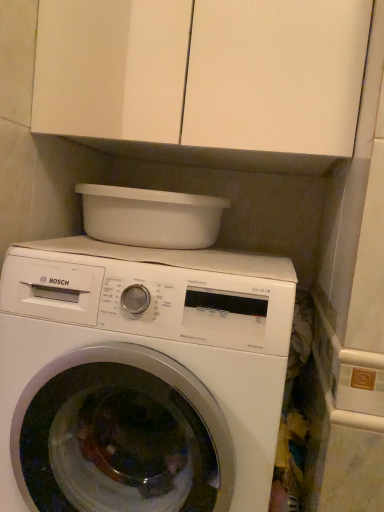
Question: Is white glossy washing machine at center beside white plastic basin at upper center?

Choices:
 (A) no
 (B) yes

Answer: (A)

Question: Can you confirm if white glossy washing machine at center is smaller than white plastic basin at upper center?

Choices:
 (A) yes
 (B) no

Answer: (B)

Question: Is white glossy washing machine at center in front of white plastic basin at upper center?

Choices:
 (A) yes
 (B) no

Answer: (A)

Question: From a real-world perspective, is white glossy washing machine at center positioned under white plastic basin at upper center based on gravity?

Choices:
 (A) no
 (B) yes

Answer: (B)

Question: Does white glossy washing machine at center turn towards white plastic basin at upper center?

Choices:
 (A) no
 (B) yes

Answer: (A)

Question: Is white glossy washing machine at center wider or thinner than white matte cabinet at upper center?

Choices:
 (A) wide
 (B) thin

Answer: (A)

Question: Is white glossy washing machine at center bigger or smaller than white matte cabinet at upper center?

Choices:
 (A) small
 (B) big

Answer: (B)

Question: From a real-world perspective, is white glossy washing machine at center positioned above or below white matte cabinet at upper center?

Choices:
 (A) below
 (B) above

Answer: (A)

Question: Relative to white matte cabinet at upper center, is white glossy washing machine at center in front or behind?

Choices:
 (A) behind
 (B) front

Answer: (B)

Question: Considering the positions of white glossy washing machine at center and white plastic basin at upper center in the image, is white glossy washing machine at center taller or shorter than white plastic basin at upper center?

Choices:
 (A) tall
 (B) short

Answer: (A)

Question: From a real-world perspective, is white glossy washing machine at center above or below white plastic basin at upper center?

Choices:
 (A) below
 (B) above

Answer: (A)

Question: Considering the relative positions of white glossy washing machine at center and white plastic basin at upper center in the image provided, is white glossy washing machine at center to the left or to the right of white plastic basin at upper center?

Choices:
 (A) left
 (B) right

Answer: (B)

Question: In terms of size, does white glossy washing machine at center appear bigger or smaller than white plastic basin at upper center?

Choices:
 (A) big
 (B) small

Answer: (A)

Question: From the image's perspective, relative to white plastic basin at upper center, is white matte cabinet at upper center above or below?

Choices:
 (A) above
 (B) below

Answer: (A)

Question: Would you say white matte cabinet at upper center is inside or outside white plastic basin at upper center?

Choices:
 (A) inside
 (B) outside

Answer: (B)